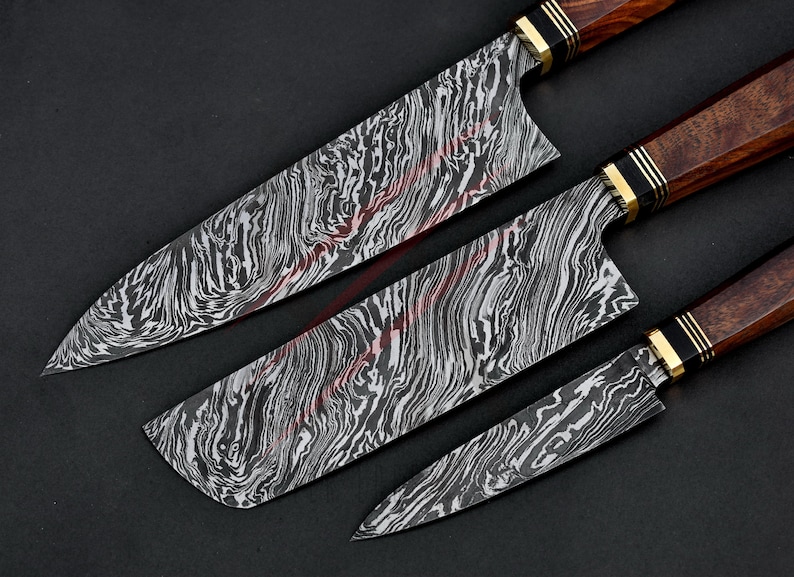
Where is `wooden "handle"`? This screenshot has height=577, width=794. wooden "handle" is located at coordinates (754, 118), (633, 8), (771, 290).